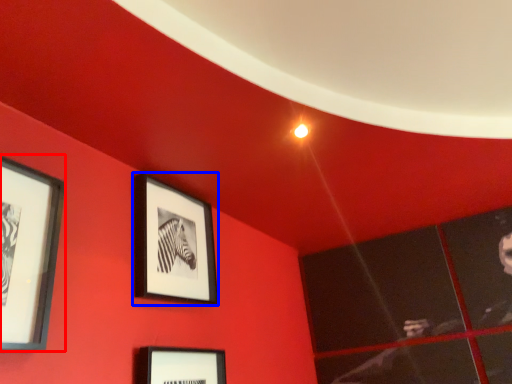
Question: Which object is closer to the camera taking this photo, picture frame (highlighted by a red box) or picture frame (highlighted by a blue box)?

Choices:
 (A) picture frame
 (B) picture frame

Answer: (A)